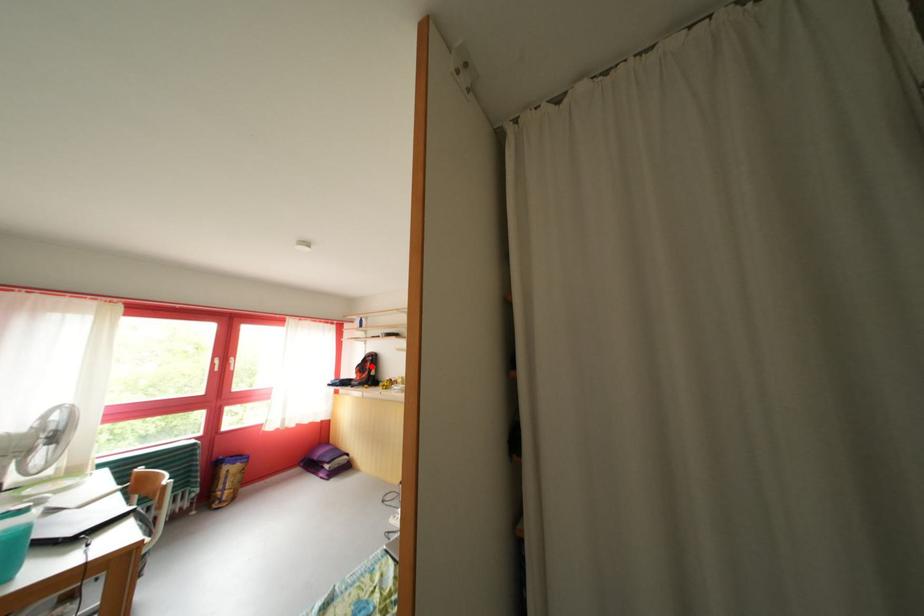
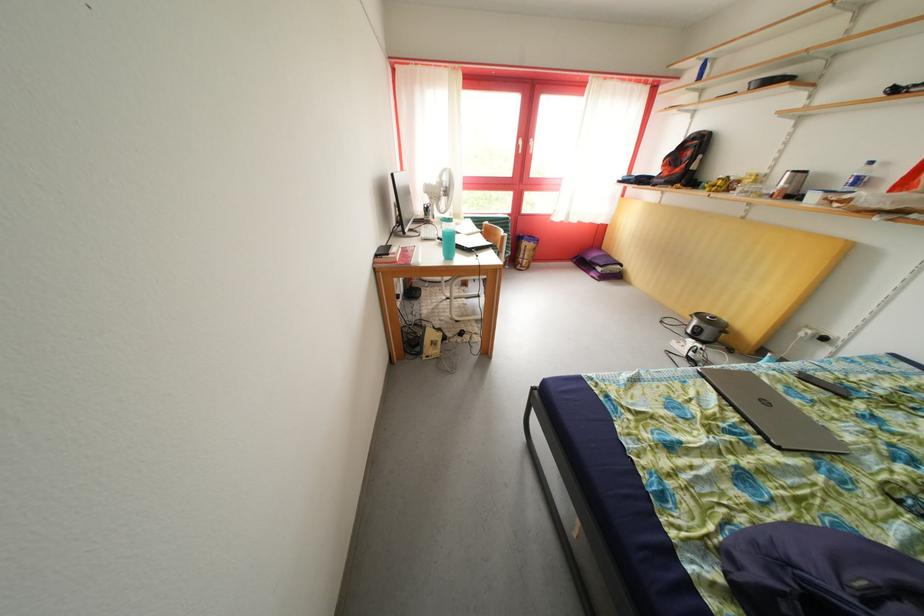
Find the pixel in the second image that matches the highlighted location in the first image.

(689, 153)